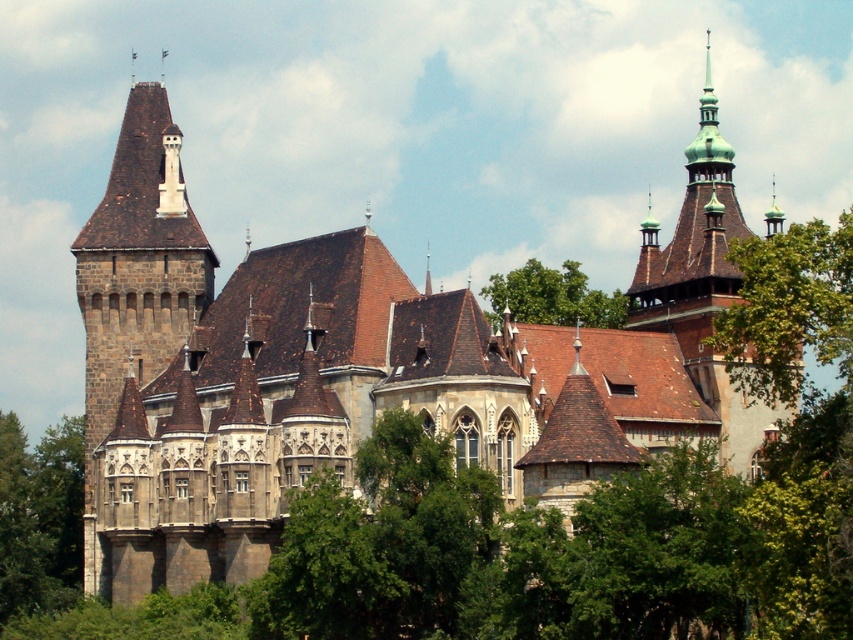
Does green copper spire at upper right have a smaller size compared to green leafy tree at upper right?

Incorrect, green copper spire at upper right is not smaller in size than green leafy tree at upper right.

Can you confirm if green copper spire at upper right is thinner than green leafy tree at upper right?

Indeed, green copper spire at upper right has a lesser width compared to green leafy tree at upper right.

Locate an element on the screen. The image size is (853, 640). green copper spire at upper right is located at coordinates (701, 285).

Does dark brown stone tower at left have a smaller size compared to green copper spire at upper right?

Yes, dark brown stone tower at left is smaller than green copper spire at upper right.

Which of these two, dark brown stone tower at left or green copper spire at upper right, stands shorter?

dark brown stone tower at left is shorter.

The height and width of the screenshot is (640, 853). Find the location of `dark brown stone tower at left`. dark brown stone tower at left is located at coordinates (135, 276).

Can you confirm if green leafy tree at upper right is smaller than green leafy tree at upper center?

No.

You are a GUI agent. You are given a task and a screenshot of the screen. Output one action in this format:
    pyautogui.click(x=<x>, y=<y>)
    Task: Click on the green leafy tree at upper right
    
    Given the screenshot: What is the action you would take?
    pyautogui.click(x=788, y=308)